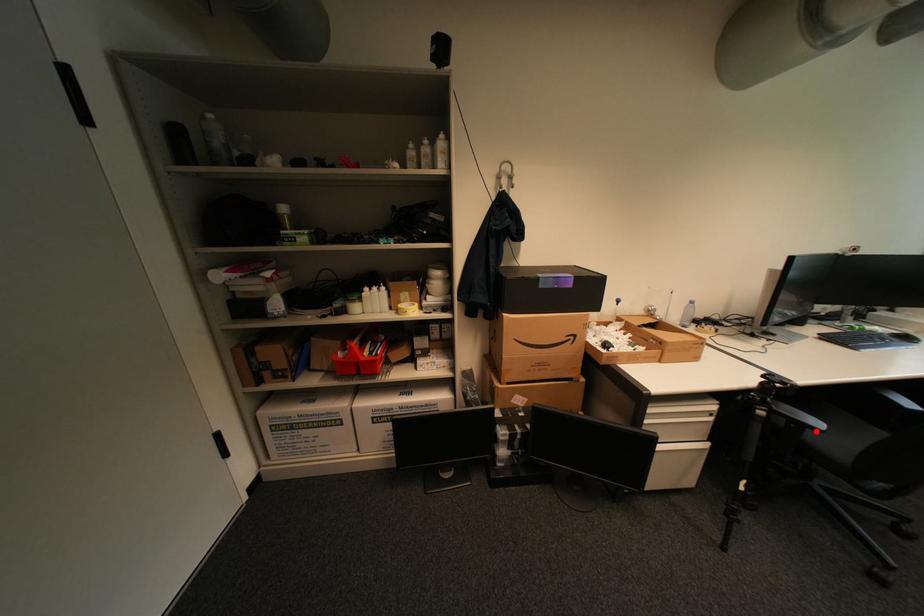
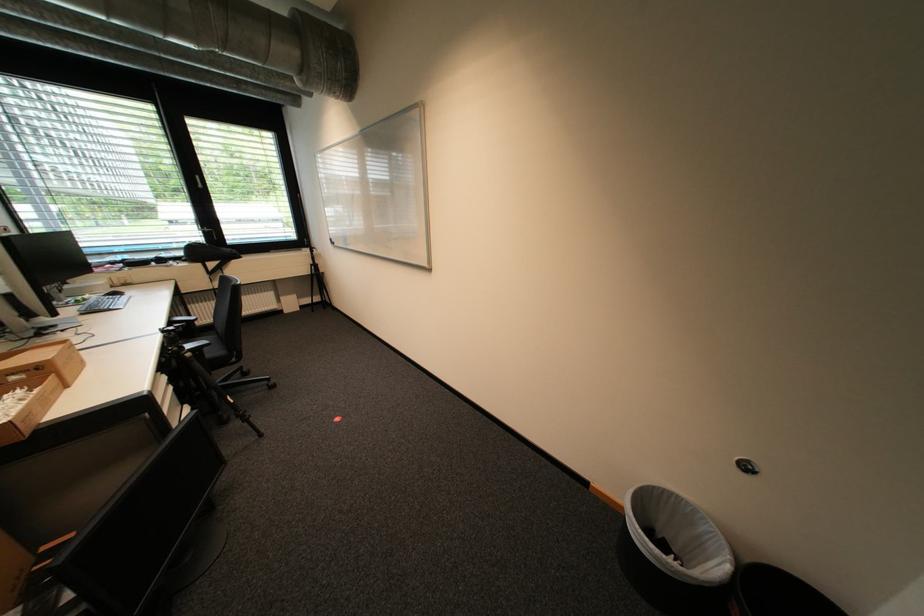
Question: A red point is marked in image1. In image2, is the corresponding 3D point closer to the camera or farther? Reply with the corresponding letter.

Choices:
 (A) The corresponding 3D point is closer.
 (B) The corresponding 3D point is farther.

Answer: (A)